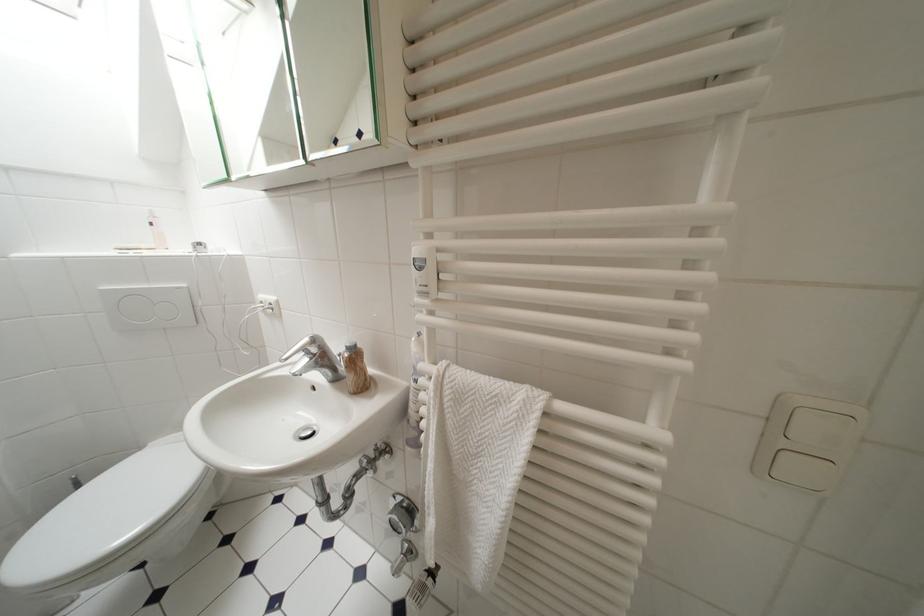
Locate an element on the screen. This screenshot has height=616, width=924. small flush button is located at coordinates (306, 432).